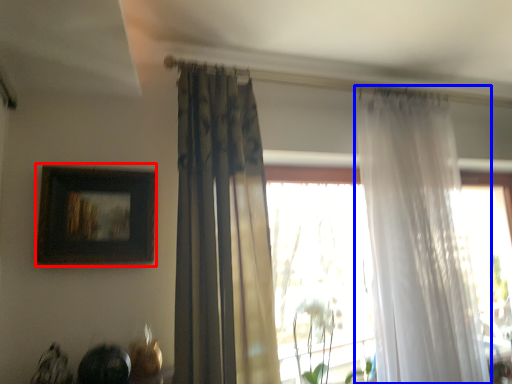
Question: Which object is further to the camera taking this photo, picture frame (highlighted by a red box) or curtain (highlighted by a blue box)?

Choices:
 (A) picture frame
 (B) curtain

Answer: (B)